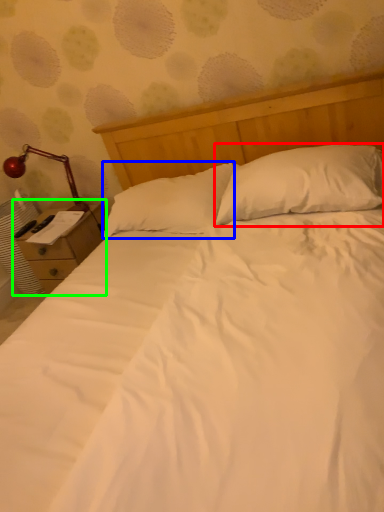
Question: Which object is positioned farthest from pillow (highlighted by a red box)? Select from pillow (highlighted by a blue box) and nightstand (highlighted by a green box).

Choices:
 (A) pillow
 (B) nightstand

Answer: (B)